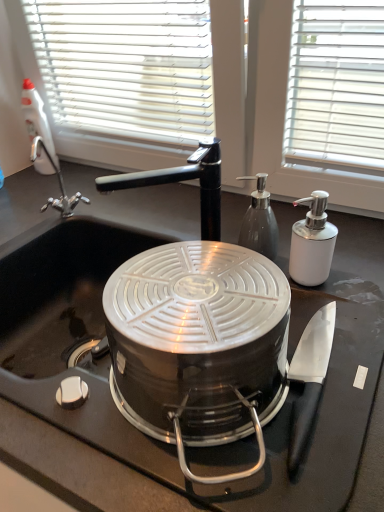
Question: Is translucent glass soap dispenser at center, the second kitchen appliance viewed from the right, wider than white plastic spray bottle at upper left?

Choices:
 (A) no
 (B) yes

Answer: (A)

Question: From a real-world perspective, is translucent glass soap dispenser at center, the second kitchen appliance viewed from the right, below white plastic spray bottle at upper left?

Choices:
 (A) no
 (B) yes

Answer: (B)

Question: From the image's perspective, is translucent glass soap dispenser at center, the second kitchen appliance viewed from the right, located above white plastic spray bottle at upper left?

Choices:
 (A) no
 (B) yes

Answer: (A)

Question: Is translucent glass soap dispenser at center, the 1th kitchen appliance in the left-to-right sequence, far from white plastic spray bottle at upper left?

Choices:
 (A) no
 (B) yes

Answer: (A)

Question: Considering the relative positions of translucent glass soap dispenser at center, the second kitchen appliance viewed from the right, and white plastic spray bottle at upper left in the image provided, is translucent glass soap dispenser at center, the second kitchen appliance viewed from the right, in front of white plastic spray bottle at upper left?

Choices:
 (A) yes
 (B) no

Answer: (A)

Question: Does translucent glass soap dispenser at center, the 1th kitchen appliance in the left-to-right sequence, have a larger size compared to white plastic spray bottle at upper left?

Choices:
 (A) no
 (B) yes

Answer: (A)

Question: From the image's perspective, is white glossy soap dispenser at right, marked as the second kitchen appliance in a left-to-right arrangement, located beneath translucent glass soap dispenser at center, the 1th kitchen appliance in the left-to-right sequence?

Choices:
 (A) yes
 (B) no

Answer: (A)

Question: Would you say white glossy soap dispenser at right, the first kitchen appliance positioned from the right, is a long distance from translucent glass soap dispenser at center, the second kitchen appliance viewed from the right?

Choices:
 (A) no
 (B) yes

Answer: (A)

Question: Is translucent glass soap dispenser at center, the second kitchen appliance viewed from the right, at the back of white glossy soap dispenser at right, the first kitchen appliance positioned from the right?

Choices:
 (A) no
 (B) yes

Answer: (A)

Question: Is white glossy soap dispenser at right, marked as the second kitchen appliance in a left-to-right arrangement, facing towards translucent glass soap dispenser at center, the 1th kitchen appliance in the left-to-right sequence?

Choices:
 (A) no
 (B) yes

Answer: (A)

Question: Would you say white glossy soap dispenser at right, the first kitchen appliance positioned from the right, contains translucent glass soap dispenser at center, the second kitchen appliance viewed from the right?

Choices:
 (A) no
 (B) yes

Answer: (A)

Question: Is white glossy soap dispenser at right, marked as the second kitchen appliance in a left-to-right arrangement, directly adjacent to translucent glass soap dispenser at center, the 1th kitchen appliance in the left-to-right sequence?

Choices:
 (A) no
 (B) yes

Answer: (B)

Question: Does black matte sink at center have a lesser width compared to white plastic spray bottle at upper left?

Choices:
 (A) no
 (B) yes

Answer: (A)